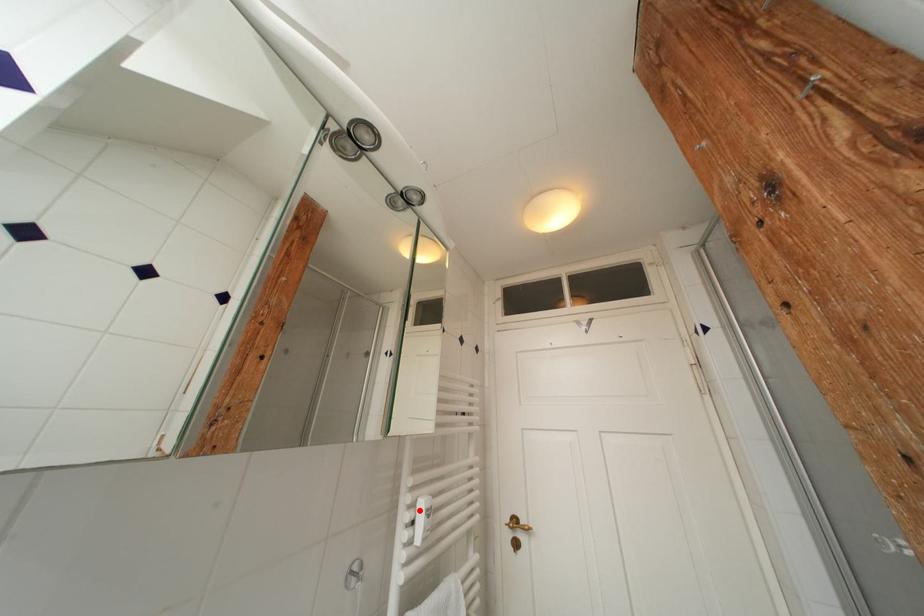
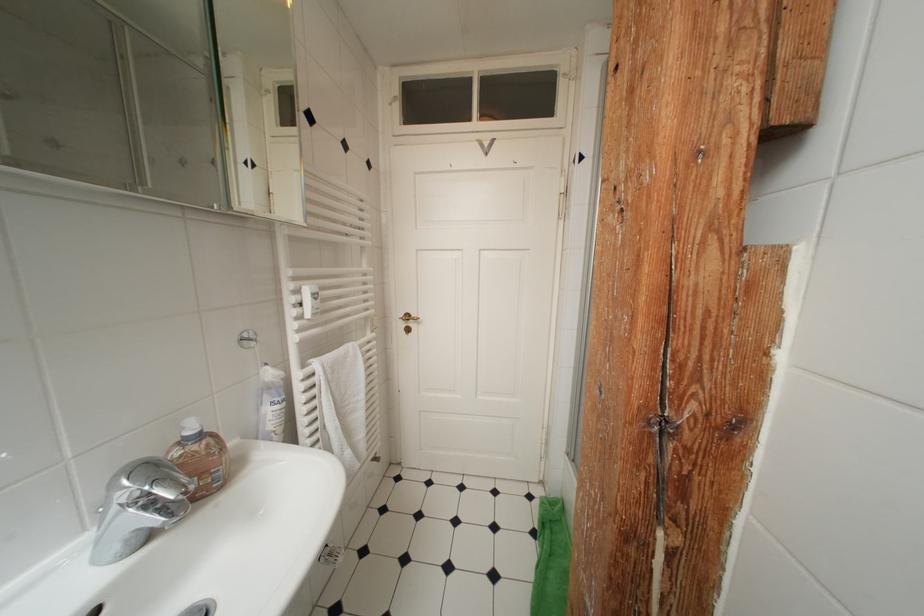
Locate, in the second image, the point that corresponds to the highlighted location in the first image.

(304, 294)